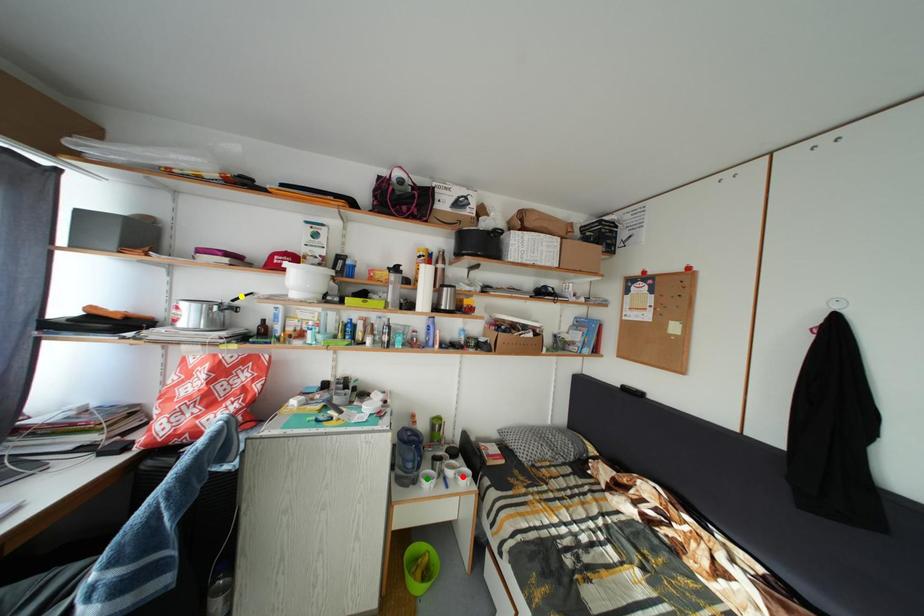
Order these from nearest to farthest:
A) green point
B) red point
C) yellow point

1. yellow point
2. green point
3. red point